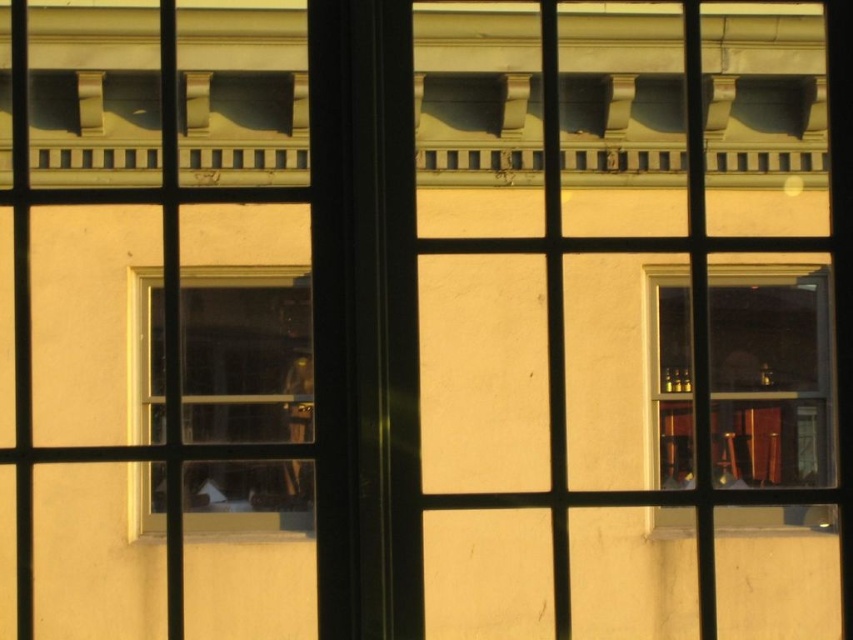
You are an interior designer planning to install a large painting on the wall behind the transparent glass window at center and the transparent glass window at upper right. Considering their sizes, which window should the painting be placed above to ensure it looks balanced?

The transparent glass window at center is bigger than the transparent glass window at upper right, so placing the painting above the transparent glass window at center would create a balanced look since the painting can proportionally match the larger window.

You are standing inside the room and want to look outside through the windows. Which window, the transparent glass window at center or the transparent glass window at upper right, allows you to see the exterior more clearly?

The transparent glass window at center allows you to see the exterior more clearly because it is in front of the transparent glass window at upper right, making it closer to your view.